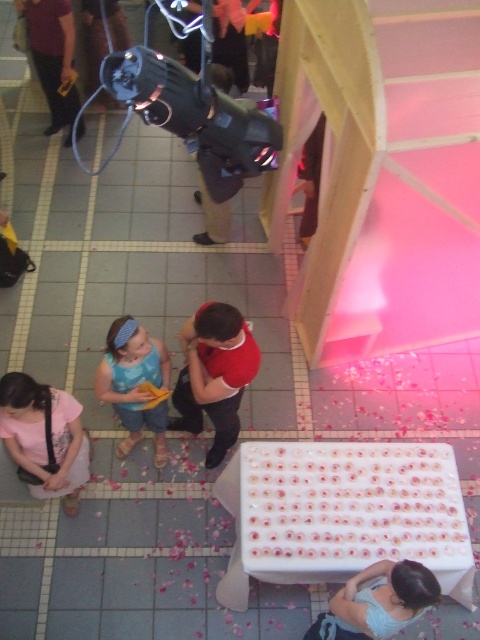
You are at the indoor event and want to walk from the table with the pink objects to the wooden structure with the triangular cutout. Which point, point (73, 465) or point (139, 326), is closer to your starting position?

Point (73, 465) is closer to the starting position because it is further to the viewer than point (139, 326).

You are a photographer at the event and need to position a camera on the table. The camera requires a space wider than the combined width of the matte pink shirt at lower left and blue denim shorts at lower left. Can you place it there?

The matte pink shirt at lower left has a larger width than the blue denim shorts at lower left. However, without knowing the exact combined width, it is impossible to determine if the camera can be placed there.